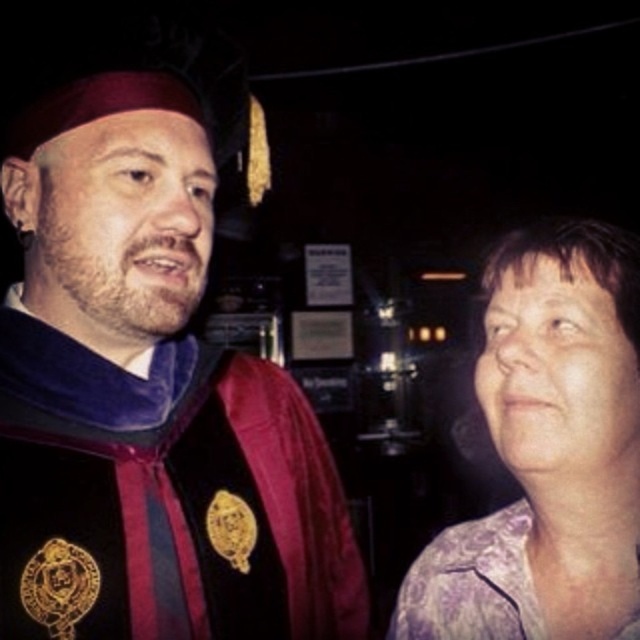
Can you confirm if velvet black graduation gown at left is positioned above purple satin blouse at right?

Correct, velvet black graduation gown at left is located above purple satin blouse at right.

Is point (292, 600) closer to viewer compared to point (406, 584)?

No.

Between point (212, 531) and point (426, 588), which one is positioned in front?

Positioned in front is point (212, 531).

Identify the location of velvet black graduation gown at left. (147, 401).

Who is higher up, purple textured blouse at right or purple satin blouse at right?

purple textured blouse at right

Is purple textured blouse at right to the right of purple satin blouse at right from the viewer's perspective?

Indeed, purple textured blouse at right is positioned on the right side of purple satin blouse at right.

Which is in front, point (484, 355) or point (449, 541)?

Point (484, 355) is in front.

The height and width of the screenshot is (640, 640). I want to click on purple textured blouse at right, so click(x=548, y=451).

Is velvet black graduation gown at left positioned before purple textured blouse at right?

That is False.

What do you see at coordinates (147, 401) in the screenshot? The width and height of the screenshot is (640, 640). I see `velvet black graduation gown at left` at bounding box center [147, 401].

Where is `velvet black graduation gown at left`? The width and height of the screenshot is (640, 640). velvet black graduation gown at left is located at coordinates (147, 401).